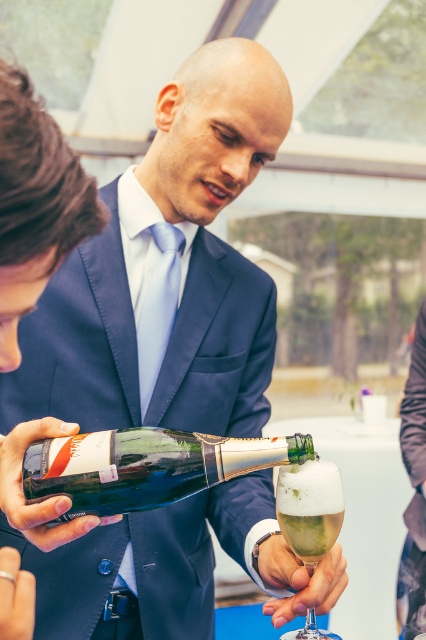
Question: Among these objects, which one is farthest from the camera?

Choices:
 (A) clear glass wine at center
 (B) clear glass wine glass at center

Answer: (A)

Question: Among these objects, which one is nearest to the camera?

Choices:
 (A) clear glass wine at center
 (B) shiny metallic champagne bottle at center
 (C) clear glass wine glass at center

Answer: (B)

Question: Does shiny metallic champagne bottle at center appear under clear glass wine at center?

Choices:
 (A) no
 (B) yes

Answer: (A)

Question: Does shiny metallic champagne bottle at center come in front of clear glass wine at center?

Choices:
 (A) yes
 (B) no

Answer: (A)

Question: Is shiny metallic champagne bottle at center thinner than clear glass wine glass at center?

Choices:
 (A) yes
 (B) no

Answer: (B)

Question: Among these points, which one is farthest from the camera?

Choices:
 (A) coord(319,518)
 (B) coord(157,476)
 (C) coord(339,506)

Answer: (C)